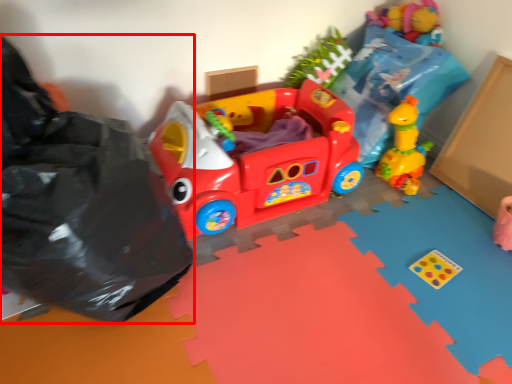
Question: Considering the relative positions of garbage (annotated by the red box) and toy in the image provided, where is garbage (annotated by the red box) located with respect to the staircase?

Choices:
 (A) right
 (B) left

Answer: (B)